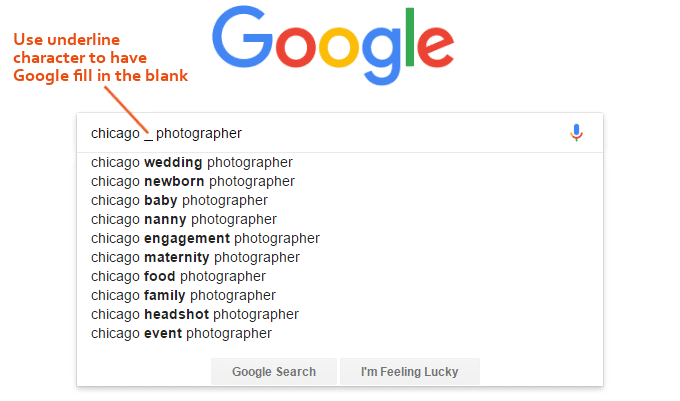
At what (x,y) coordinates should I click in order to perform the action: click on window. Please return your answer as a coordinate pair (x, y). Looking at the image, I should click on (330, 109), (73, 238), (598, 235), (336, 386).